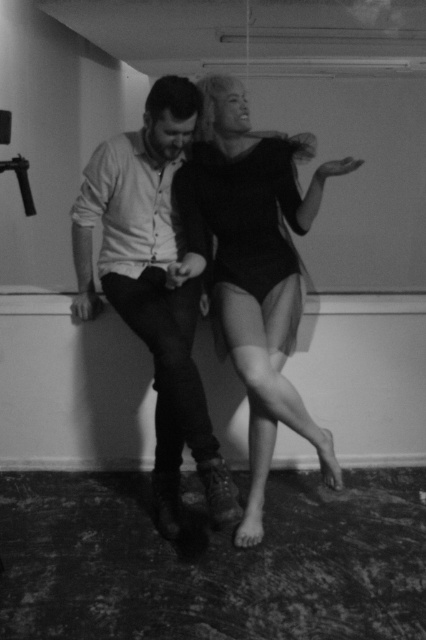
Question: Considering the relative positions of smooth black bodysuit at center and black matte dress at center in the image provided, where is smooth black bodysuit at center located with respect to black matte dress at center?

Choices:
 (A) left
 (B) right

Answer: (B)

Question: Which point is farther from the camera taking this photo?

Choices:
 (A) (210, 193)
 (B) (181, 440)
 (C) (273, 244)

Answer: (C)

Question: Among these objects, which one is farthest from the camera?

Choices:
 (A) matte white shirt at center
 (B) smooth black bodysuit at center
 (C) black matte dress at center

Answer: (C)

Question: Does smooth black bodysuit at center appear under matte white shirt at center?

Choices:
 (A) no
 (B) yes

Answer: (A)

Question: Which object appears closest to the camera in this image?

Choices:
 (A) smooth black bodysuit at center
 (B) matte white shirt at center

Answer: (B)

Question: Is smooth black bodysuit at center to the right of black matte dress at center from the viewer's perspective?

Choices:
 (A) yes
 (B) no

Answer: (A)